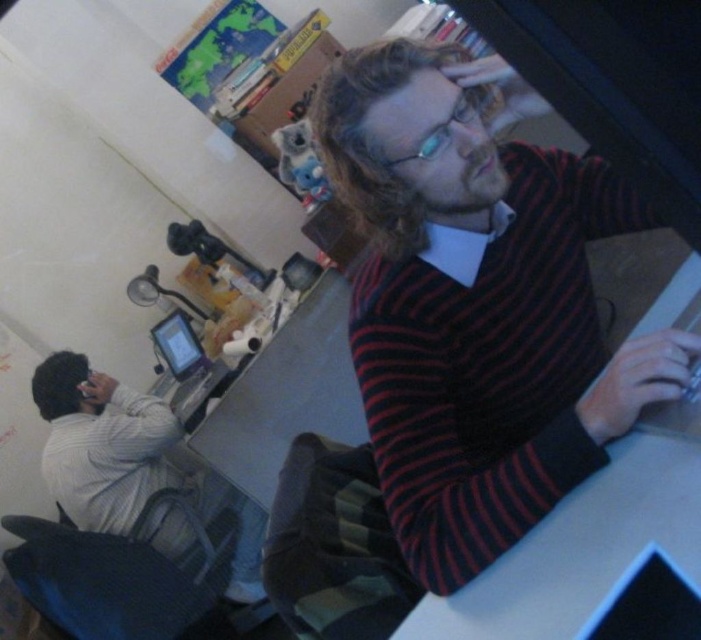
You are in an office and need to reach both the light gray sweater at left and the matte black tablet at center. If your arm can extend 12 inches, can you grab both items without moving your body?

The light gray sweater at left is 12.99 inches away from matte black tablet at center. Since your arm can only extend 12 inches, you cannot reach both items without moving your body because the distance between them exceeds your arm length.

You are a delivery robot with a package that needs to be placed on the white plastic computer desk at center. You are currently positioned at the location of the striped sweater at center. Can you reach the desk without moving any objects?

The distance between the striped sweater at center and the white plastic computer desk at center is 22.84 centimeters, so yes, the robot can reach the desk without moving any objects since the distance is manageable.